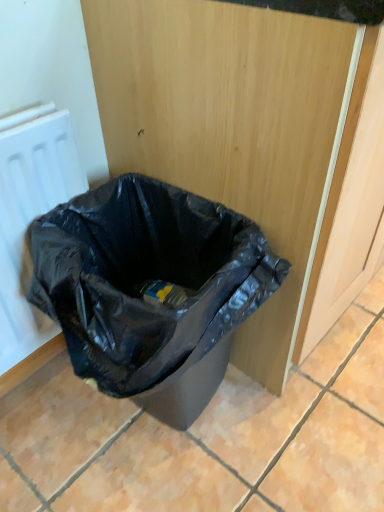
Question: In terms of height, does white matte radiator at left look taller or shorter compared to black plastic bag at lower left?

Choices:
 (A) tall
 (B) short

Answer: (A)

Question: Is point (61, 121) positioned closer to the camera than point (89, 300)?

Choices:
 (A) closer
 (B) farther

Answer: (B)

Question: From the image's perspective, is white matte radiator at left positioned above or below black plastic bag at lower left?

Choices:
 (A) above
 (B) below

Answer: (A)

Question: Considering the positions of black plastic bag at lower left and white matte radiator at left in the image, is black plastic bag at lower left wider or thinner than white matte radiator at left?

Choices:
 (A) wide
 (B) thin

Answer: (A)

Question: From a real-world perspective, is black plastic bag at lower left positioned above or below white matte radiator at left?

Choices:
 (A) above
 (B) below

Answer: (B)

Question: Is black plastic bag at lower left inside or outside of white matte radiator at left?

Choices:
 (A) inside
 (B) outside

Answer: (B)

Question: Considering their positions, is black plastic bag at lower left located in front of or behind white matte radiator at left?

Choices:
 (A) behind
 (B) front

Answer: (B)